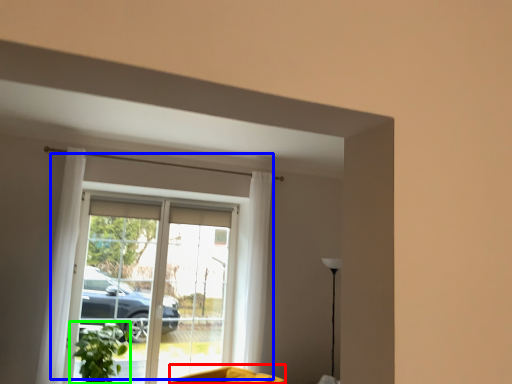
Question: Which object is positioned closest to swivel chair (highlighted by a red box)? Select from window (highlighted by a blue box) and houseplant (highlighted by a green box).

Choices:
 (A) window
 (B) houseplant

Answer: (B)